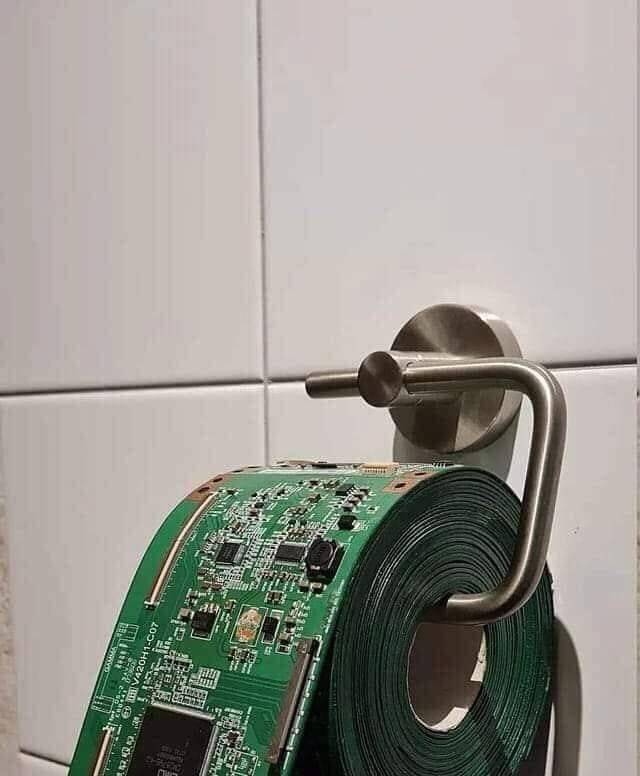
Locate an element on the screen. This screenshot has height=776, width=640. shadow of the toilet paper roll handle on the wall on the bottom right of the photo is located at coordinates (575, 684).